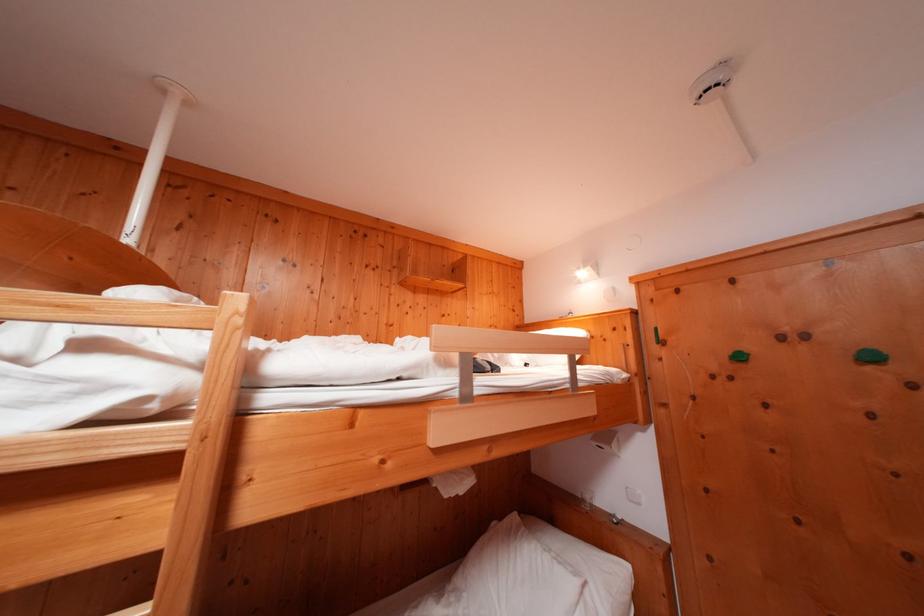
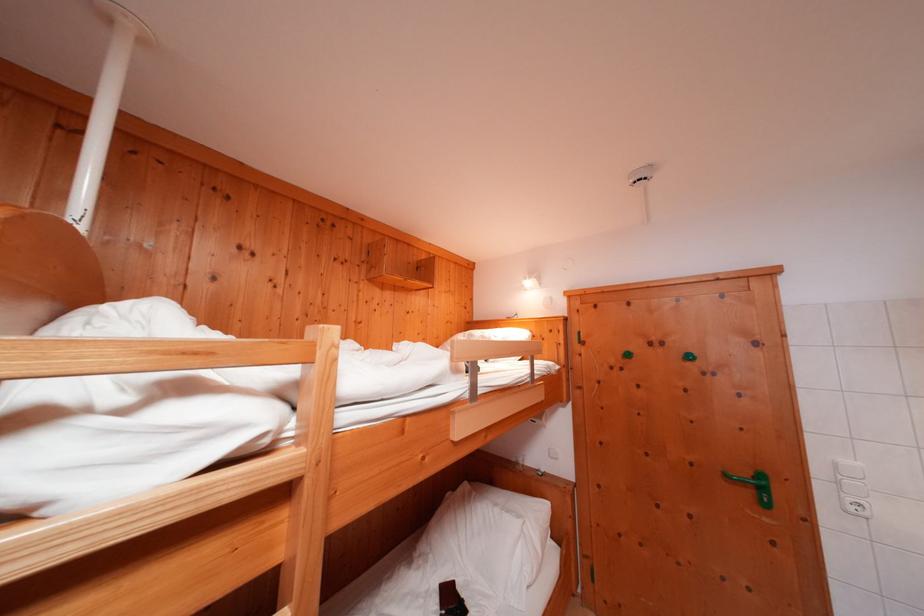
Locate, in the second image, the point that corresponds to the point at 629,525 in the first image.

(552, 477)